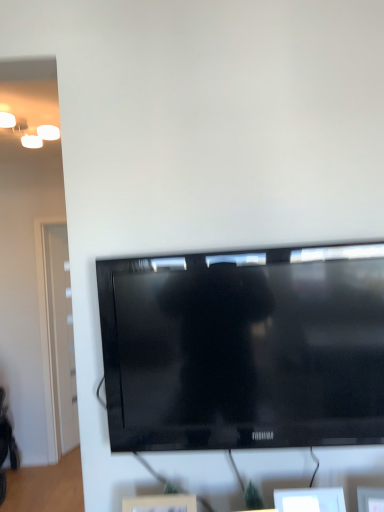
Locate an element on the screen. black glossy tv at center is located at coordinates (244, 348).

Describe the element at coordinates (244, 348) in the screenshot. I see `black glossy tv at center` at that location.

Find the location of a particular element. black glossy tv at center is located at coordinates (244, 348).